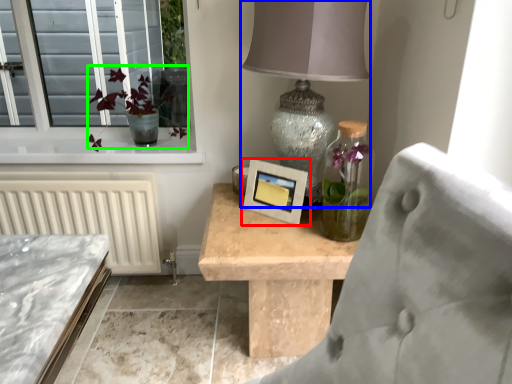
Question: Estimate the real-world distances between objects in this image. Which object is farther from picture frame (highlighted by a red box), table lamp (highlighted by a blue box) or floral arrangement (highlighted by a green box)?

Choices:
 (A) table lamp
 (B) floral arrangement

Answer: (B)